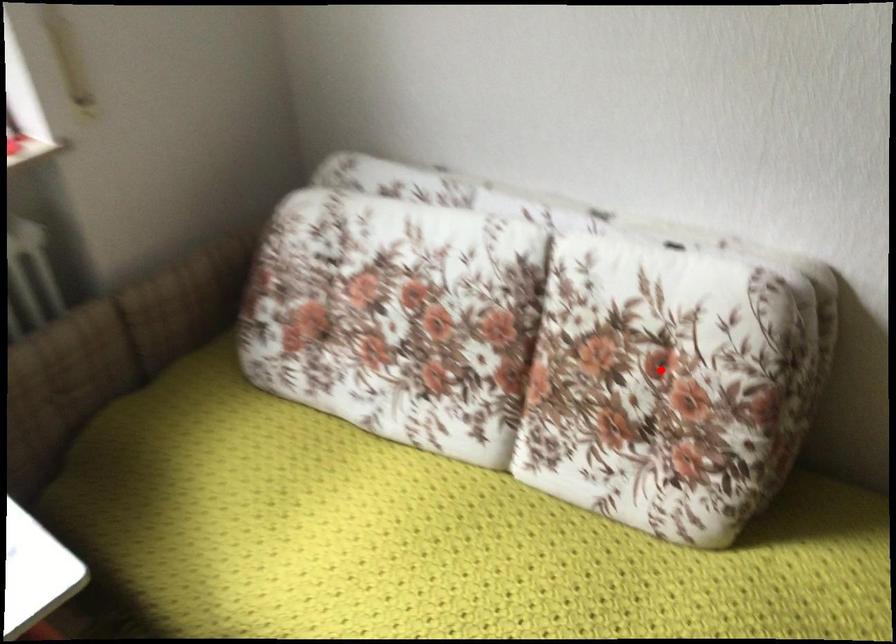
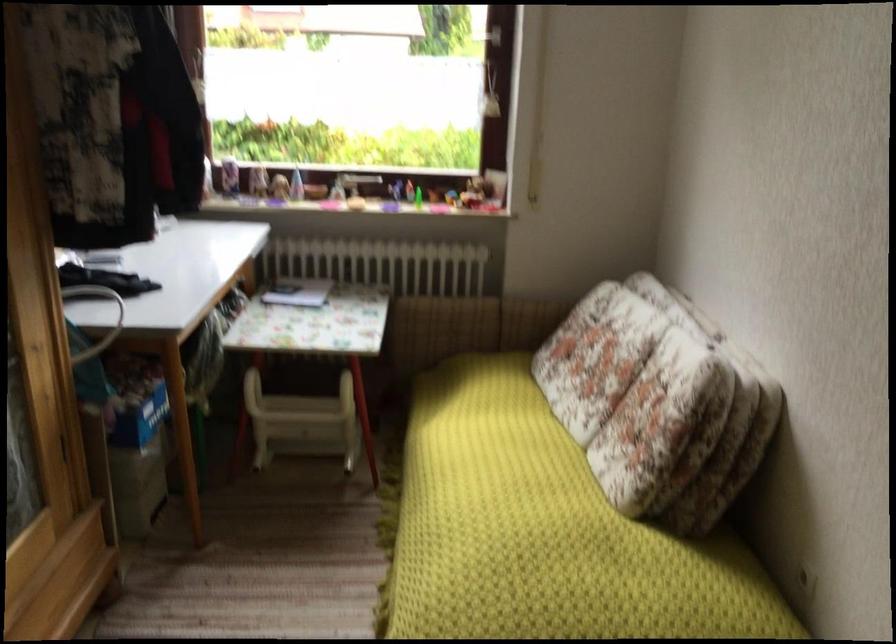
Find the pixel in the second image that matches the highlighted location in the first image.

(658, 402)